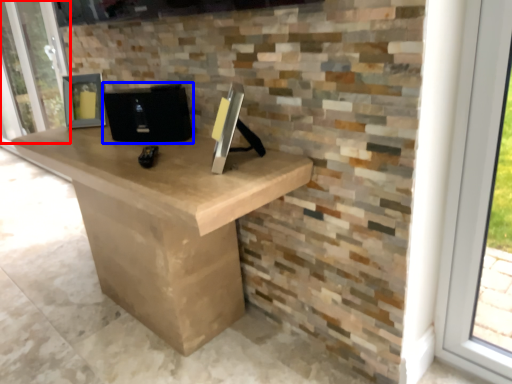
Question: Which object appears farthest to the camera in this image, screen door (highlighted by a red box) or computer (highlighted by a blue box)?

Choices:
 (A) screen door
 (B) computer

Answer: (A)